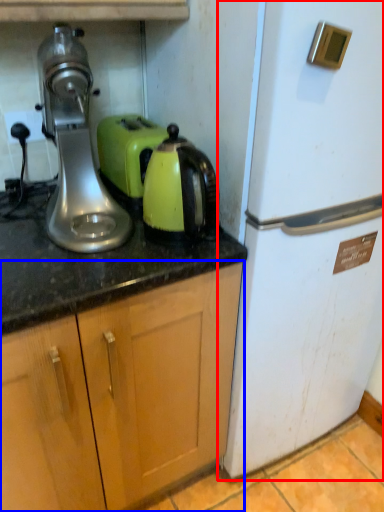
Question: Which of the following is the closest to the observer, refrigerator (highlighted by a red box) or cabinetry (highlighted by a blue box)?

Choices:
 (A) refrigerator
 (B) cabinetry

Answer: (B)